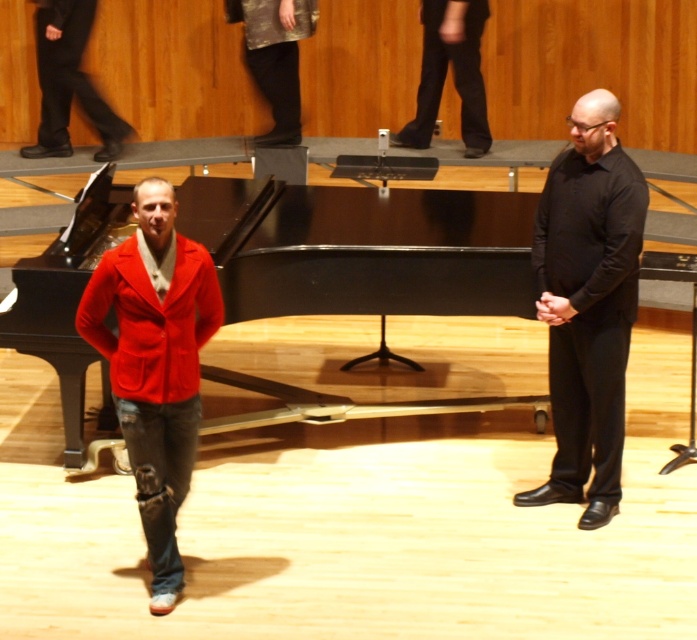
Question: Which point is closer to the camera taking this photo?

Choices:
 (A) (123, 353)
 (B) (291, 6)
 (C) (91, 292)

Answer: (C)

Question: Does matte red jacket at left come in front of camouflage-patterned jacket at center?

Choices:
 (A) no
 (B) yes

Answer: (B)

Question: Which object appears closest to the camera in this image?

Choices:
 (A) matte red jacket at left
 (B) black smooth pants at upper center

Answer: (A)

Question: Considering the relative positions of black smooth shirt at right and black smooth pants at upper center in the image provided, where is black smooth shirt at right located with respect to black smooth pants at upper center?

Choices:
 (A) below
 (B) above

Answer: (A)

Question: Observing the image, what is the correct spatial positioning of black smooth shirt at right in reference to matte red blazer at left?

Choices:
 (A) left
 (B) right

Answer: (B)

Question: Based on their relative distances, which object is farther from the matte red jacket at left?

Choices:
 (A) black polished piano at center
 (B) black smooth pants at upper center
 (C) denim jacket at left

Answer: (B)